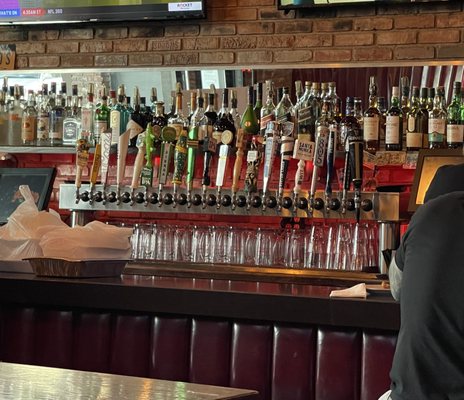
Where is `computer screen`? computer screen is located at coordinates (438, 178).